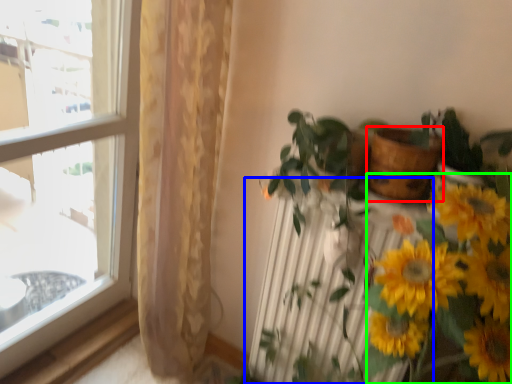
Question: Which is farther away from flowerpot (highlighted by a red box)? radiator (highlighted by a blue box) or floral arrangement (highlighted by a green box)?

Choices:
 (A) radiator
 (B) floral arrangement

Answer: (A)